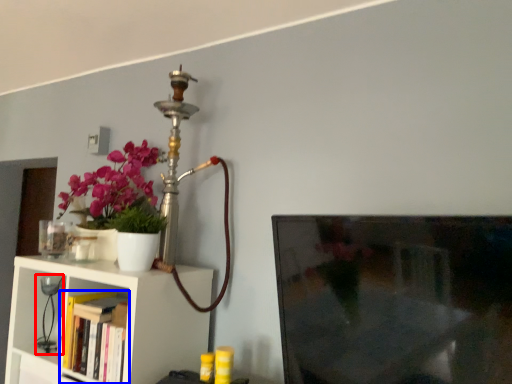
Question: Which object is further to the camera taking this photo, table lamp (highlighted by a red box) or book (highlighted by a blue box)?

Choices:
 (A) table lamp
 (B) book

Answer: (A)